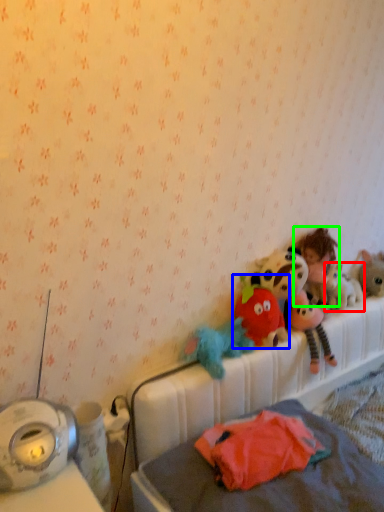
Question: Which object is positioned farthest from toy (highlighted by a red box)? Select from toy (highlighted by a blue box) and person (highlighted by a green box).

Choices:
 (A) toy
 (B) person

Answer: (A)